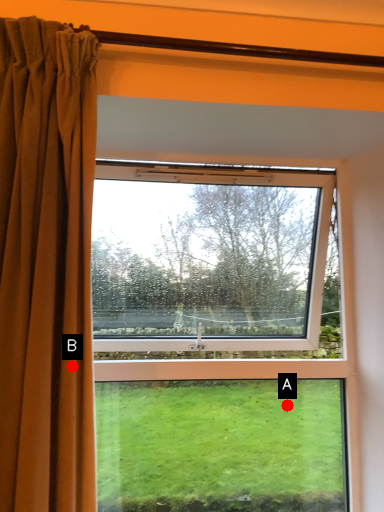
Question: Two points are circled on the image, labeled by A and B beside each circle. Which point appears farthest from the camera in this image?

Choices:
 (A) A is further
 (B) B is further

Answer: (A)